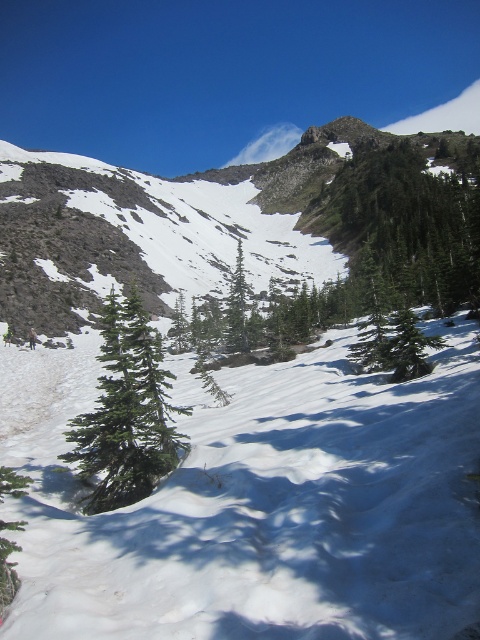
You are standing at the base of the mountain and see two points marked on the slope. The first point is at coordinates point [389,198] and the second is at point [245,314]. If you want to reach the point closer to you, which one should you head towards?

You should head towards point [389,198] because it is closer to you than point [245,314].